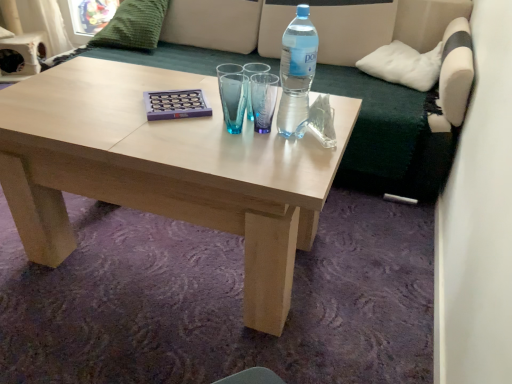
Question: Considering the positions of green fabric couch at upper center and natural wood coffee table at center in the image, is green fabric couch at upper center taller or shorter than natural wood coffee table at center?

Choices:
 (A) short
 (B) tall

Answer: (B)

Question: Considering the relative positions of green fabric couch at upper center and natural wood coffee table at center in the image provided, is green fabric couch at upper center to the left or to the right of natural wood coffee table at center?

Choices:
 (A) right
 (B) left

Answer: (A)

Question: Estimate the real-world distances between objects in this image. Which object is farther from the transparent plastic bottle at upper right?

Choices:
 (A) natural wood coffee table at center
 (B) green knitted pillow at upper left, the second pillow positioned from the bottom
 (C) green fabric couch at upper center
 (D) white soft cushion at upper right, arranged as the first pillow when viewed from the right

Answer: (B)

Question: Which of these objects is positioned closest to the green fabric couch at upper center?

Choices:
 (A) green knitted pillow at upper left, the second pillow positioned from the bottom
 (B) transparent plastic bottle at upper right
 (C) white soft cushion at upper right, arranged as the first pillow when viewed from the right
 (D) natural wood coffee table at center

Answer: (C)